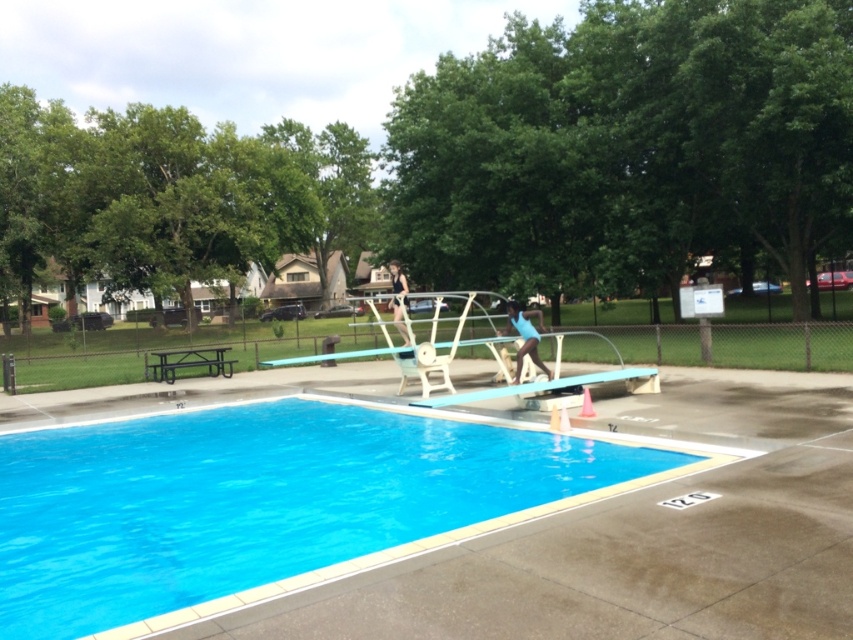
Is blue smooth pool at center bigger than black metal picnic table at lower left?

Correct, blue smooth pool at center is larger in size than black metal picnic table at lower left.

Between blue smooth pool at center and black metal picnic table at lower left, which one has less height?

With less height is black metal picnic table at lower left.

Find the location of a particular element. This screenshot has width=853, height=640. blue smooth pool at center is located at coordinates (254, 500).

Does green leafy tree at upper left have a larger size compared to black metal picnic table at lower left?

Indeed, green leafy tree at upper left has a larger size compared to black metal picnic table at lower left.

Can you confirm if green leafy tree at upper left is positioned above black metal picnic table at lower left?

Indeed, green leafy tree at upper left is positioned over black metal picnic table at lower left.

Between point (294, 193) and point (155, 376), which one is positioned behind?

The point (294, 193) is behind.

Where is `green leafy tree at upper left`? green leafy tree at upper left is located at coordinates (170, 195).

Can you confirm if green leafy tree at upper center is positioned to the left of green leafy tree at upper left?

No, green leafy tree at upper center is not to the left of green leafy tree at upper left.

Is green leafy tree at upper center thinner than green leafy tree at upper left?

Yes, green leafy tree at upper center is thinner than green leafy tree at upper left.

What do you see at coordinates (628, 147) in the screenshot? I see `green leafy tree at upper center` at bounding box center [628, 147].

This screenshot has width=853, height=640. What are the coordinates of `green leafy tree at upper center` in the screenshot? It's located at (628, 147).